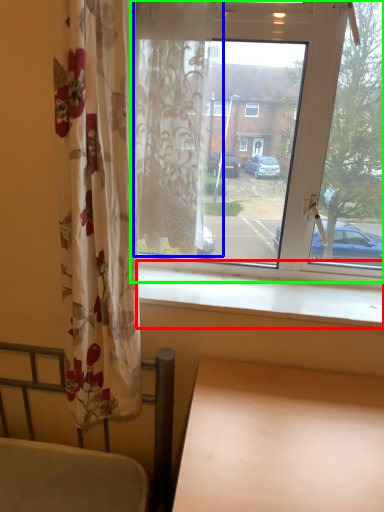
Question: Which object is positioned farthest from window sill (highlighted by a red box)? Select from curtain (highlighted by a blue box) and window (highlighted by a green box).

Choices:
 (A) curtain
 (B) window

Answer: (A)